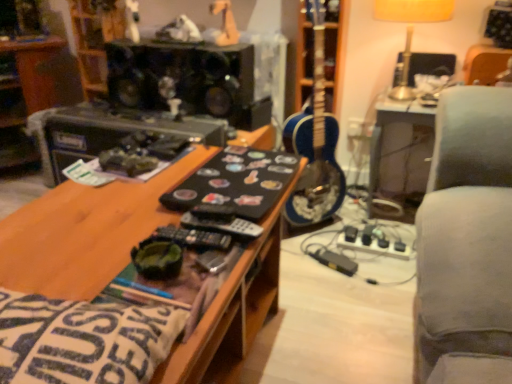
Question: Is point (134, 41) positioned closer to the camera than point (188, 26)?

Choices:
 (A) closer
 (B) farther

Answer: (B)

Question: In terms of height, does white matte toy at upper center, which is counted as the first toy, starting from the left, look taller or shorter compared to white plush toy at upper center, acting as the second toy starting from the left?

Choices:
 (A) short
 (B) tall

Answer: (B)

Question: Which of these objects is positioned farthest from the black matte speaker at upper center?

Choices:
 (A) white matte toy at upper center, which is counted as the first toy, starting from the left
 (B) matte plastic toy at upper center, which is the 1th toy from right to left
 (C) black matte remote at center
 (D) blue glossy guitar at center
 (E) matte gold table lamp at upper right

Answer: (C)

Question: Estimate the real-world distances between objects in this image. Which object is closer to the black matte speaker at upper center?

Choices:
 (A) white fabric pillow at lower left
 (B) matte gold table lamp at upper right
 (C) white plush toy at upper center, acting as the second toy starting from the left
 (D) white matte toy at upper center, which is counted as the first toy, starting from the left
 (E) black plastic shelf at upper left

Answer: (C)